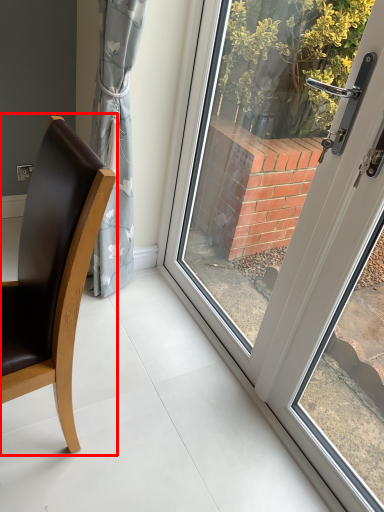
Question: In this image, where is chair (annotated by the red box) located relative to door?

Choices:
 (A) left
 (B) right

Answer: (A)